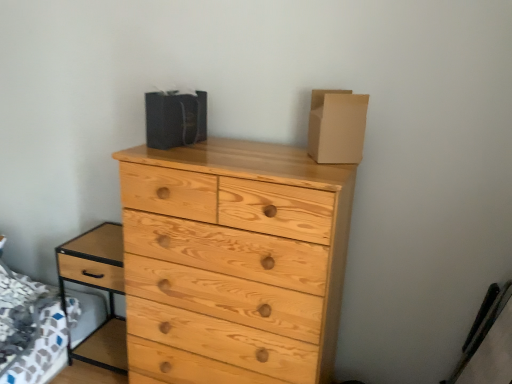
I want to click on free location to the left of brown cardboard box at upper right, the second cardboard box viewed from the left, so click(275, 151).